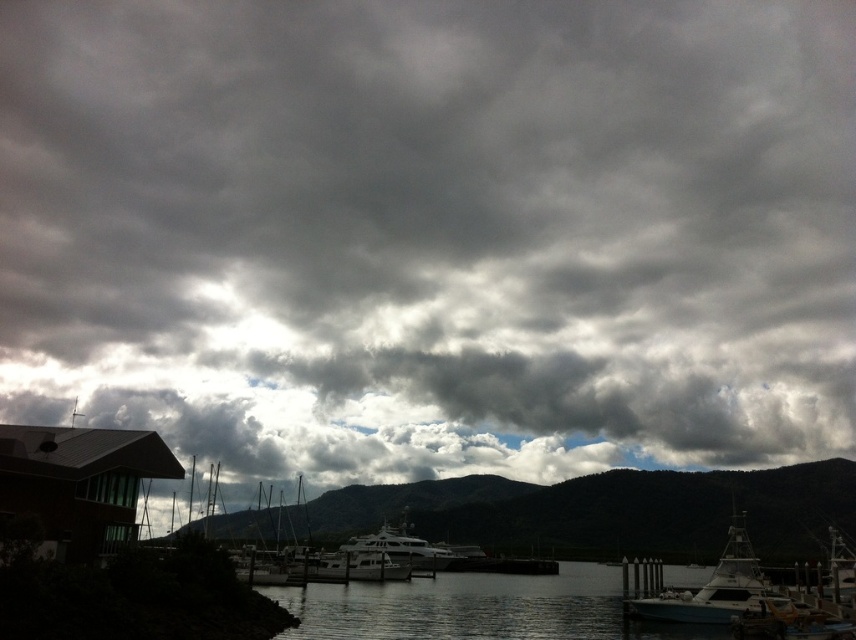
Question: Is white glossy boat at lower right further to the viewer compared to metallic silver yacht at center?

Choices:
 (A) no
 (B) yes

Answer: (A)

Question: Which of the following is the farthest from the observer?

Choices:
 (A) metallic silver yacht at center
 (B) white glossy boat at lower right
 (C) white glossy yacht at center

Answer: (C)

Question: In this image, where is white glossy boat at lower right located relative to metallic silver yacht at center?

Choices:
 (A) below
 (B) above

Answer: (A)

Question: Estimate the real-world distances between objects in this image. Which object is farther from the metallic silver yacht at center?

Choices:
 (A) white glossy yacht at center
 (B) white glossy boat at lower right

Answer: (B)

Question: Does white glossy boat at lower right lie in front of metallic silver yacht at center?

Choices:
 (A) yes
 (B) no

Answer: (A)

Question: Which point is closer to the camera taking this photo?

Choices:
 (A) (322, 556)
 (B) (391, 538)
 (C) (730, 577)

Answer: (C)